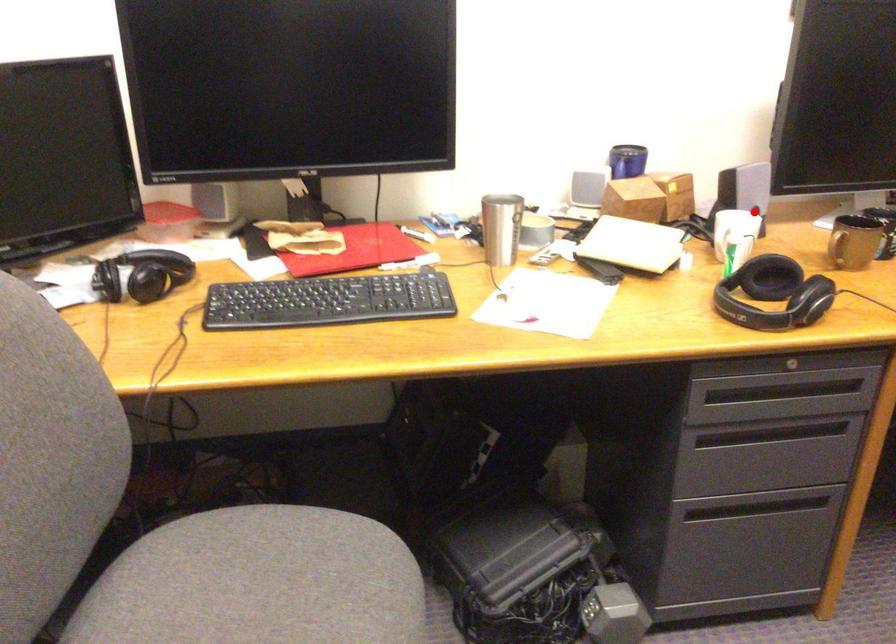
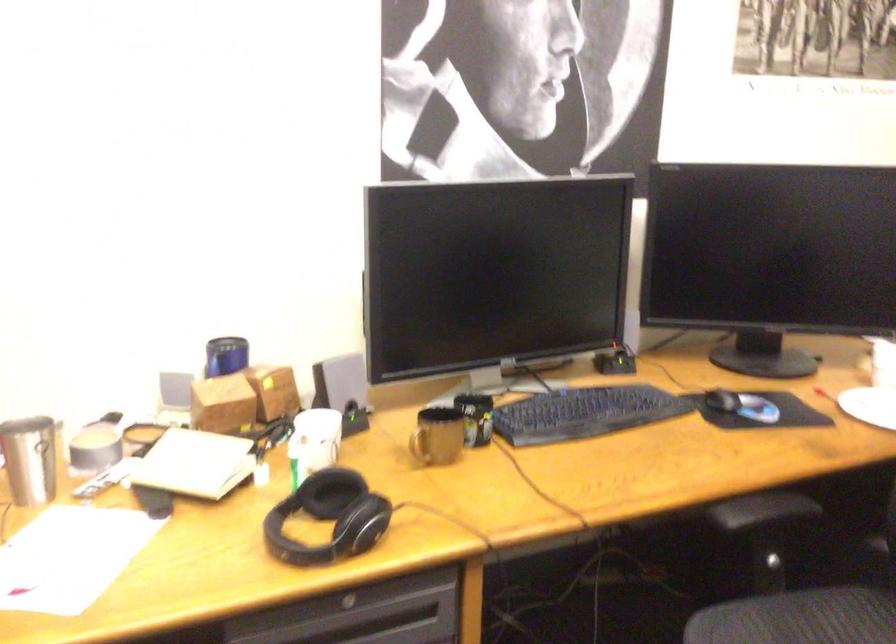
In the second image, find the point that corresponds to the highlighted location in the first image.

(352, 413)